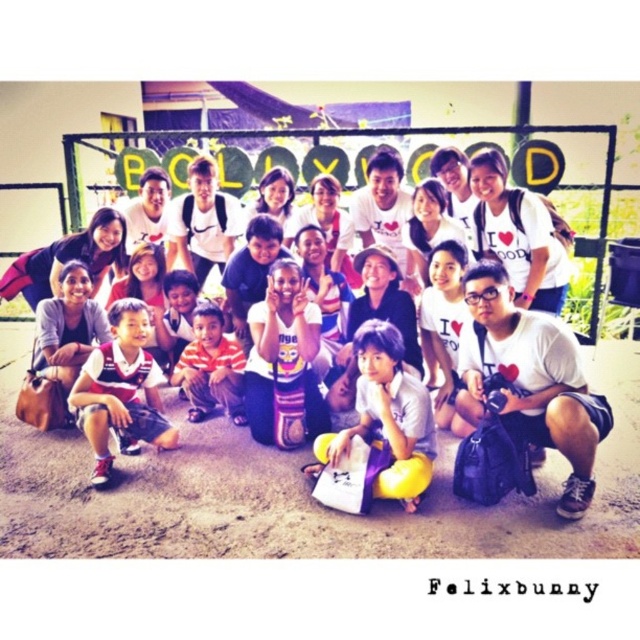
Does yellow fabric pants at lower center have a greater width compared to white matte plush toy at center?

Correct, the width of yellow fabric pants at lower center exceeds that of white matte plush toy at center.

Does yellow fabric pants at lower center have a smaller size compared to white matte plush toy at center?

Actually, yellow fabric pants at lower center might be larger than white matte plush toy at center.

What do you see at coordinates (387, 417) in the screenshot? The image size is (640, 640). I see `yellow fabric pants at lower center` at bounding box center [387, 417].

Identify the location of yellow fabric pants at lower center. This screenshot has height=640, width=640. (387, 417).

Who is more forward, (93, 440) or (212, 381)?

Point (93, 440) is more forward.

Which is in front, point (145, 408) or point (224, 378)?

Point (145, 408)

Where is `striped jersey at lower left`? striped jersey at lower left is located at coordinates (120, 388).

Consider the image. Who is more forward, [566,413] or [380,384]?

Point [566,413] is more forward.

Image resolution: width=640 pixels, height=640 pixels. Describe the element at coordinates (531, 380) in the screenshot. I see `white cotton t-shirt at center` at that location.

Locate an element on the screen. The height and width of the screenshot is (640, 640). white cotton t-shirt at center is located at coordinates (531, 380).

At what (x,y) coordinates should I click in order to perform the action: click on white cotton t-shirt at center. Please return your answer as a coordinate pair (x, y). The height and width of the screenshot is (640, 640). Looking at the image, I should click on (531, 380).